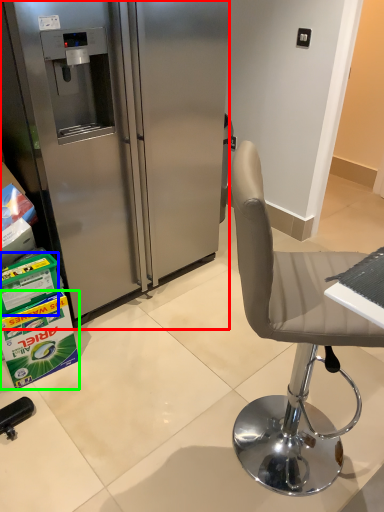
Question: Which is nearer to the refrigerator (highlighted by a red box)? box (highlighted by a blue box) or box (highlighted by a green box).

Choices:
 (A) box
 (B) box

Answer: (B)